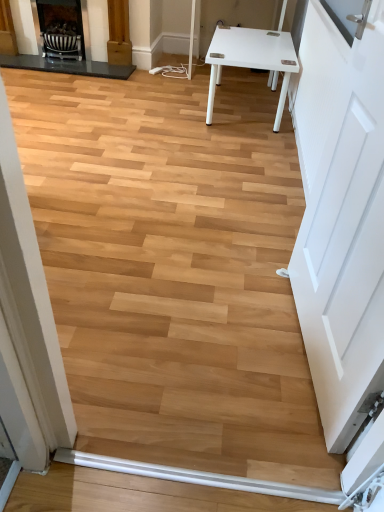
The image size is (384, 512). I want to click on vacant area on the back side of white matte door at right, so pos(251,253).